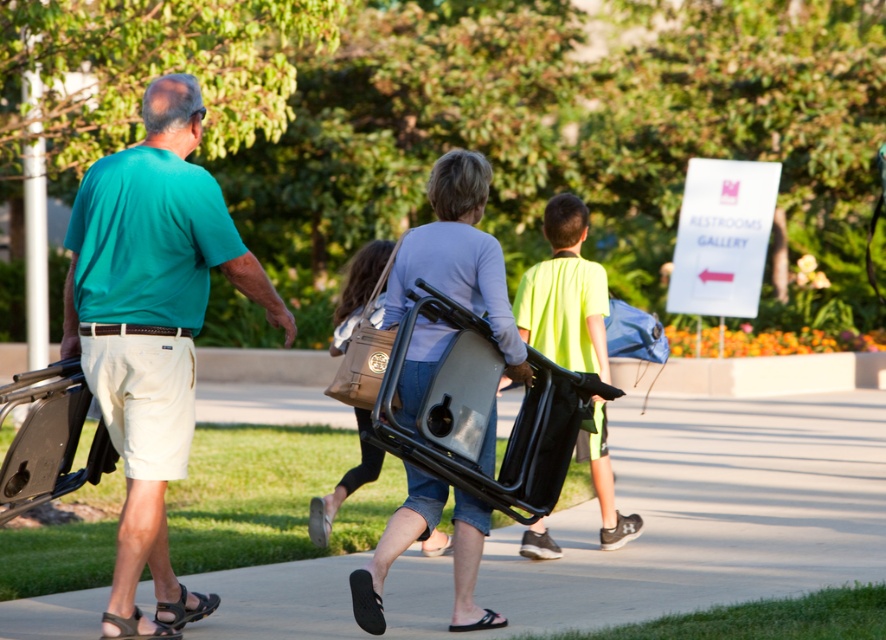
Question: Does black rubber pavement at center appear under neon yellow shirt at center?

Choices:
 (A) no
 (B) yes

Answer: (B)

Question: Which object appears closest to the camera in this image?

Choices:
 (A) neon yellow shirt at center
 (B) matte black cart at center
 (C) black rubber pavement at center
 (D) teal matte shirt at left

Answer: (D)

Question: Is black rubber pavement at center bigger than matte black cart at center?

Choices:
 (A) no
 (B) yes

Answer: (B)

Question: Which of the following is the closest to the observer?

Choices:
 (A) matte black cart at center
 (B) neon yellow shirt at center

Answer: (A)

Question: Based on their relative distances, which object is nearer to the teal matte shirt at left?

Choices:
 (A) neon yellow shirt at center
 (B) brown leather bag at center
 (C) matte black cart at center
 (D) black rubber pavement at center

Answer: (C)

Question: Where is black rubber pavement at center located in relation to neon yellow shirt at center in the image?

Choices:
 (A) below
 (B) above

Answer: (A)